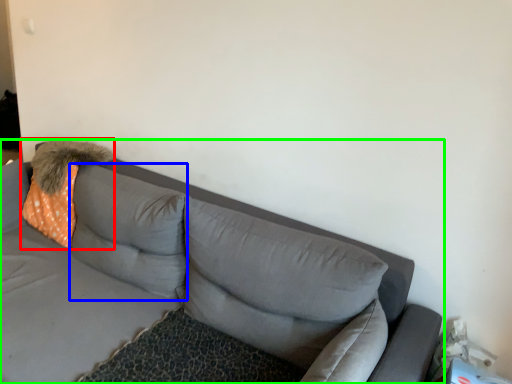
Question: Which is nearer to the throw pillow (highlighted by a red box)? pillow (highlighted by a blue box) or studio couch (highlighted by a green box).

Choices:
 (A) pillow
 (B) studio couch

Answer: (A)